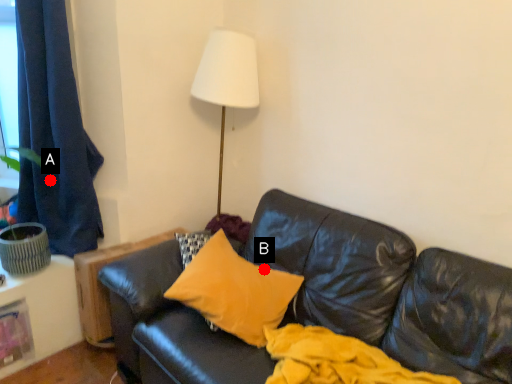
Question: Two points are circled on the image, labeled by A and B beside each circle. Which of the following is the closest to the observer?

Choices:
 (A) A is closer
 (B) B is closer

Answer: (B)